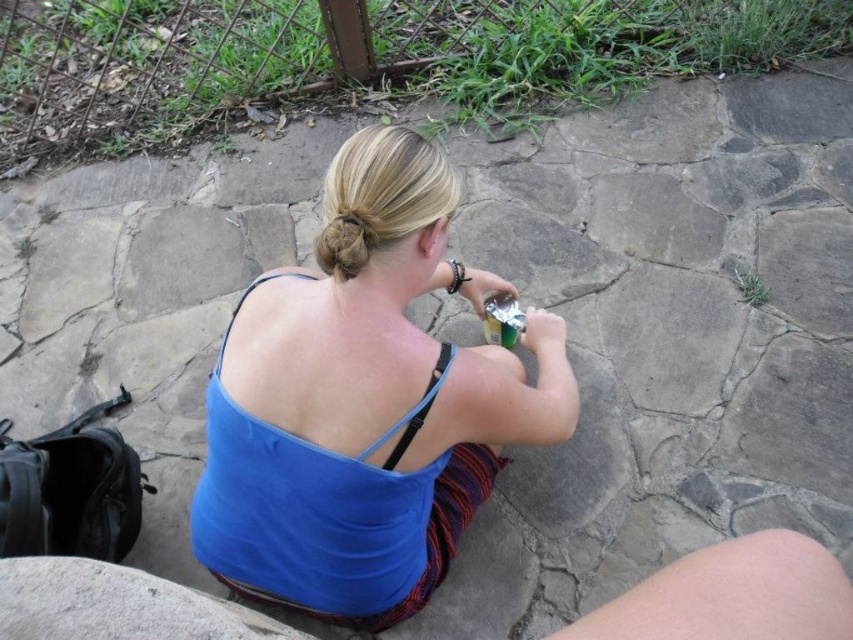
Question: Which of the following is the farthest from the observer?

Choices:
 (A) (666, 618)
 (B) (143, 592)
 (C) (253, 387)
 (D) (485, 300)

Answer: (D)

Question: Which of the following is the closest to the observer?

Choices:
 (A) (370, 246)
 (B) (509, 321)
 (C) (120, 614)

Answer: (C)

Question: Where is blue fabric tank top at center located in relation to gray rough stone at lower left in the image?

Choices:
 (A) right
 (B) left

Answer: (A)

Question: Does blue fabric tank top at center appear under gray rough stone at lower left?

Choices:
 (A) yes
 (B) no

Answer: (B)

Question: Is blonde hair at center in front of metallic green bottle at upper right?

Choices:
 (A) yes
 (B) no

Answer: (A)

Question: Considering the real-world distances, which object is farthest from the blue fabric tank top at center?

Choices:
 (A) metallic green bottle at upper right
 (B) skinny white leg at lower right

Answer: (B)